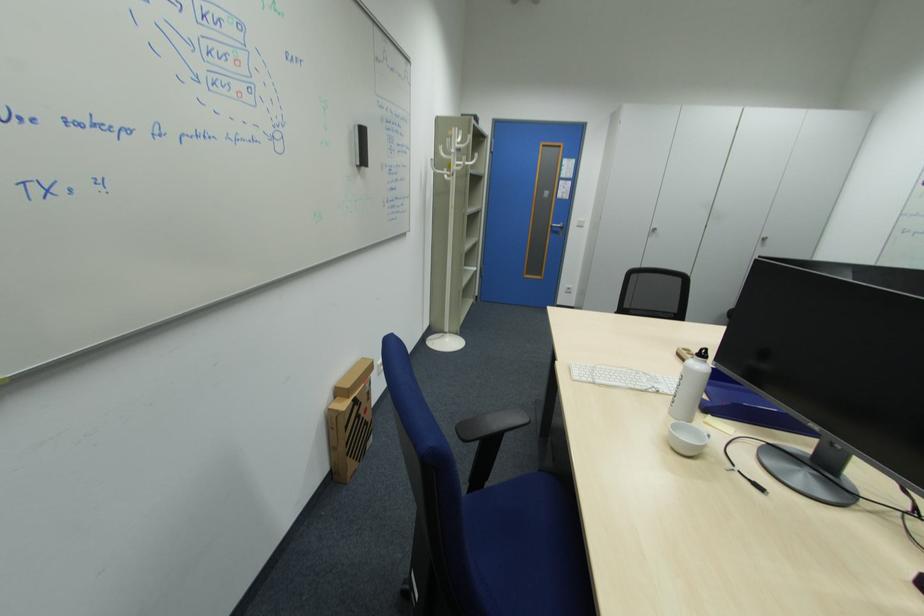
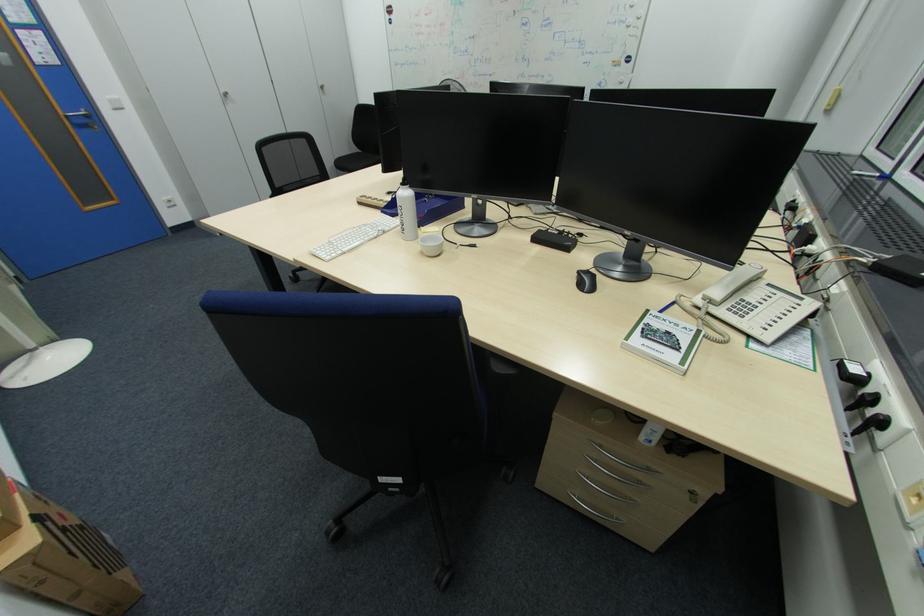
Based on the continuous images, in which direction is the camera rotating?

The rotation direction of the camera is right-down.